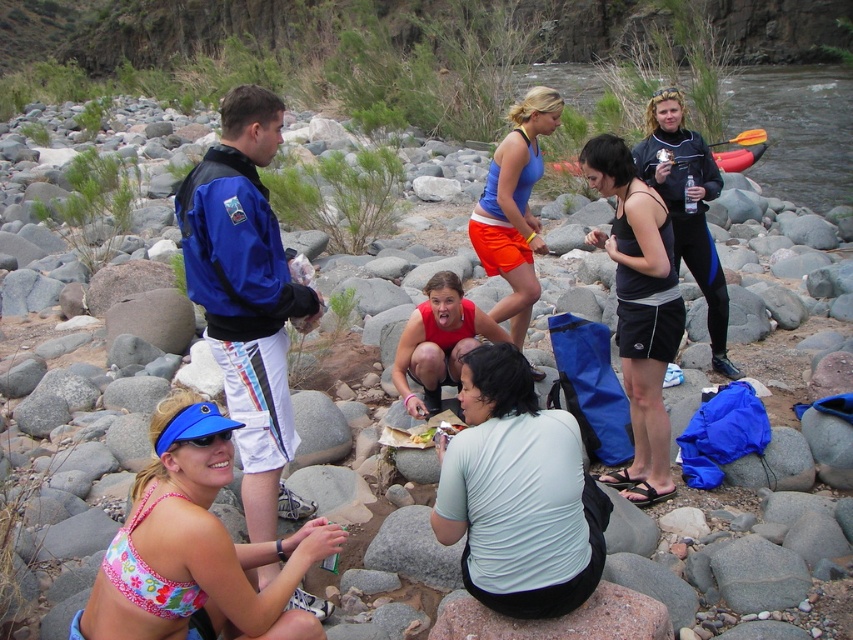
You are standing at the center of the riverbank and want to hand a map to the person wearing the blue jacket at upper left. Which direction should you move to reach them?

The blue jacket at upper left is located at point (247,298), so you should move towards the upper left direction to reach them.

You are a hiker planning to cross a rocky riverbank where the floral fabric bikini top at lower left and the black wetsuit at center are placed. Considering their widths, which clothing item would be easier to grip if you need to steady yourself while walking?

The floral fabric bikini top at lower left has a smaller width compared to the black wetsuit at center. Since it is narrower, it might be easier to grip if you need to steady yourself while walking on the rocky riverbank.

You are a photographer trying to capture a group photo of the blue jacket at upper left and the black wetsuit at center. Since you want to include both in the frame, which subject should you focus on first to ensure both are in focus?

You should focus on the blue jacket at upper left first because it is closer to you than the black wetsuit at center, so focusing on the closer subject will help both be in focus.